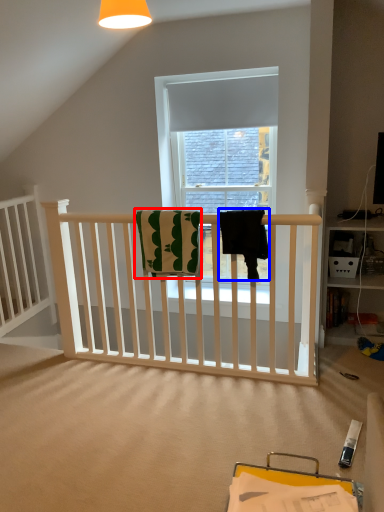
Question: Which object is further to the camera taking this photo, beach towel (highlighted by a red box) or beach towel (highlighted by a blue box)?

Choices:
 (A) beach towel
 (B) beach towel

Answer: (A)